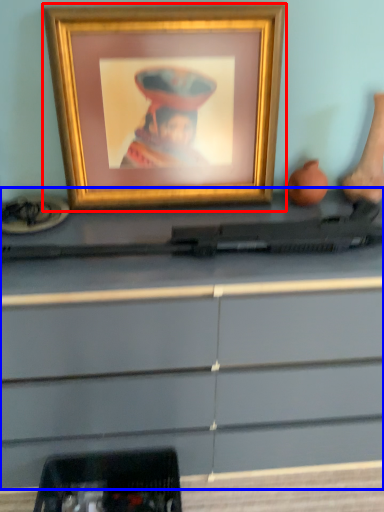
Question: Which of the following is the closest to the observer, picture frame (highlighted by a red box) or desk (highlighted by a blue box)?

Choices:
 (A) picture frame
 (B) desk

Answer: (B)